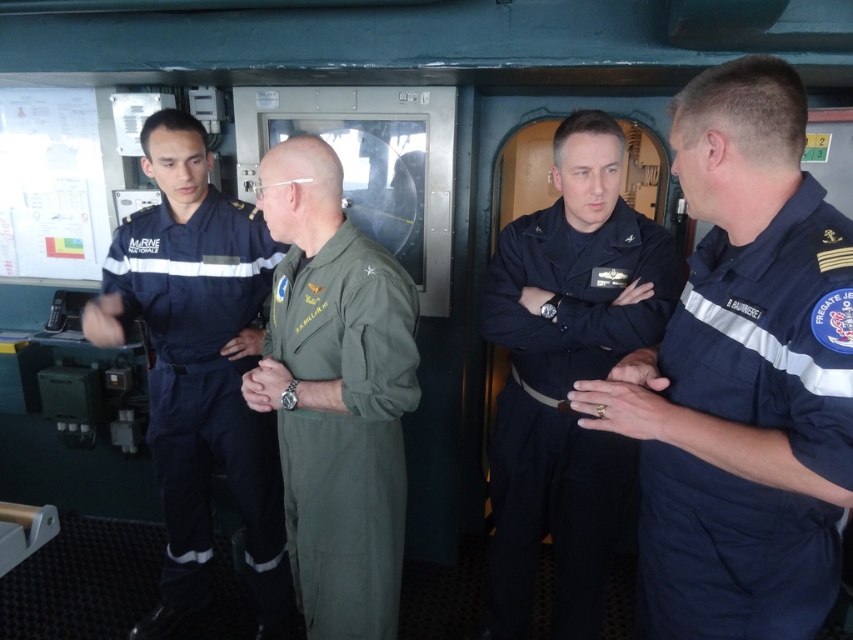
Between navy blue cotton shirt at right and green fabric jumpsuit at center, which one has less height?

navy blue cotton shirt at right is shorter.

Does navy blue cotton shirt at right lie in front of green fabric jumpsuit at center?

Yes, navy blue cotton shirt at right is closer to the viewer.

Is point (798, 250) closer to viewer compared to point (355, 545)?

Yes, point (798, 250) is closer to viewer.

Where is `navy blue cotton shirt at right`? Image resolution: width=853 pixels, height=640 pixels. navy blue cotton shirt at right is located at coordinates (772, 332).

Can you confirm if navy blue uniform at left is thinner than dark blue fabric uniform at center?

No.

Can you confirm if navy blue uniform at left is positioned to the left of dark blue fabric uniform at center?

Indeed, navy blue uniform at left is positioned on the left side of dark blue fabric uniform at center.

The image size is (853, 640). I want to click on navy blue uniform at left, so click(199, 368).

Measure the distance between navy blue cotton shirt at right and camera.

navy blue cotton shirt at right and camera are 35.79 inches apart.

Is navy blue cotton shirt at right bigger than dark blue fabric uniform at center?

Actually, navy blue cotton shirt at right might be smaller than dark blue fabric uniform at center.

In order to click on navy blue cotton shirt at right in this screenshot , I will do `click(772, 332)`.